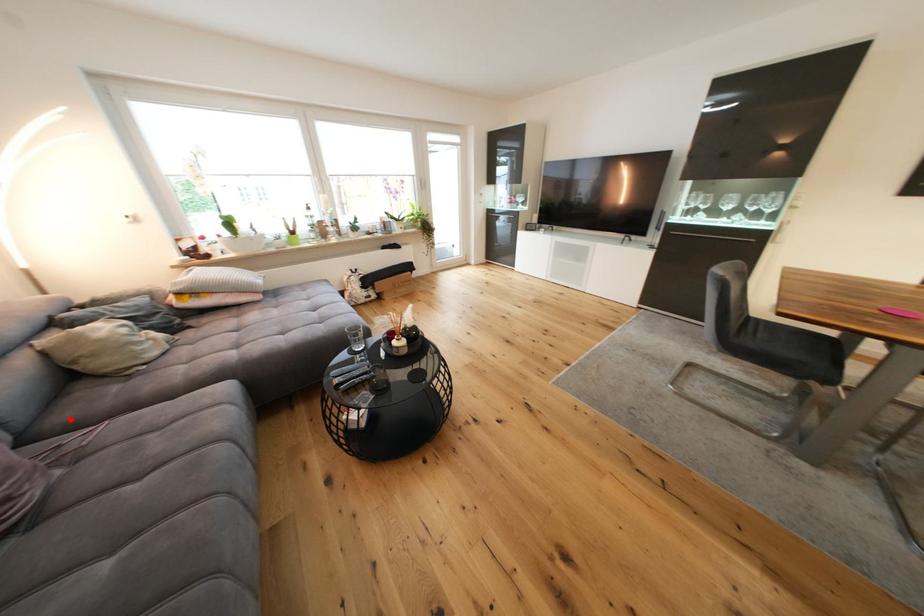
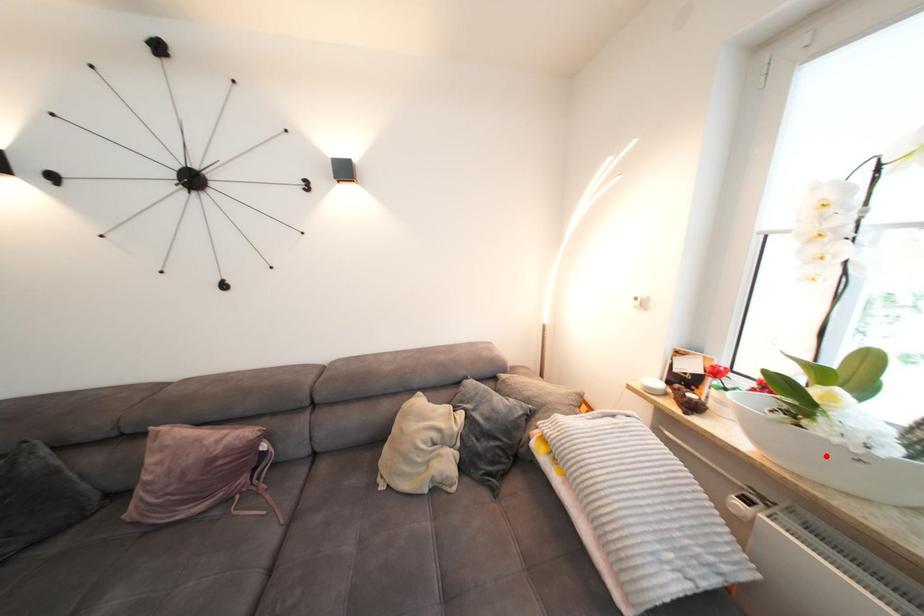
Based on the photo, I am providing you with two images of the same scene from different viewpoints. A red point is marked on the first image and another point is marked on the second image. Is the red point in image1 aligned with the point shown in image2?

No